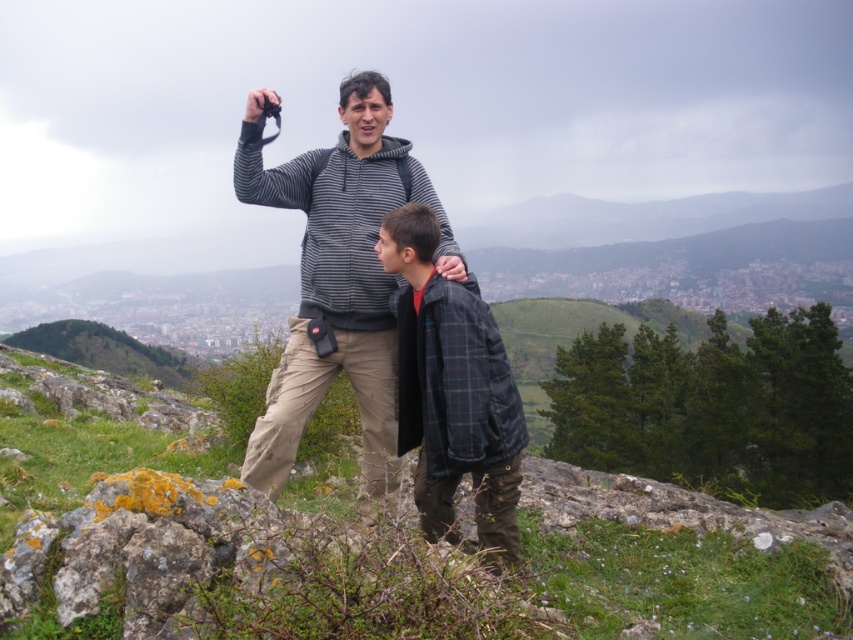
You are a photographer planning to capture a portrait of the two people in the scene. Since you want to ensure proper framing, which person wearing the striped hoodie at center or the plaid wool jacket at center should stand in the front row to make the other appear larger in the photo?

The plaid wool jacket at center should stand in the front row because the striped hoodie at center is taller. By placing the shorter person in front, the taller individual behind will appear larger in the photo due to perspective.

You are a photographer planning to capture a landscape photo of the city and mountains in the background. You notice two people in the scene, the striped hoodie at center and the plaid wool jacket at center. Which of these two people is more likely to block your view of the background if they stand in front of it?

The striped hoodie at center is more likely to block your view since the plaid wool jacket at center is behind it, meaning the striped hoodie is closer to the photographer and in front of the background.